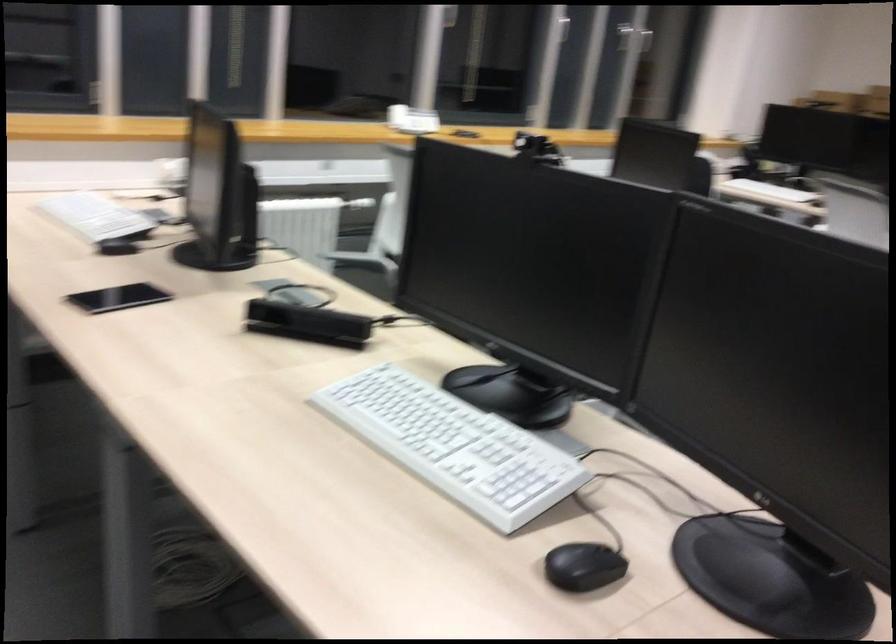
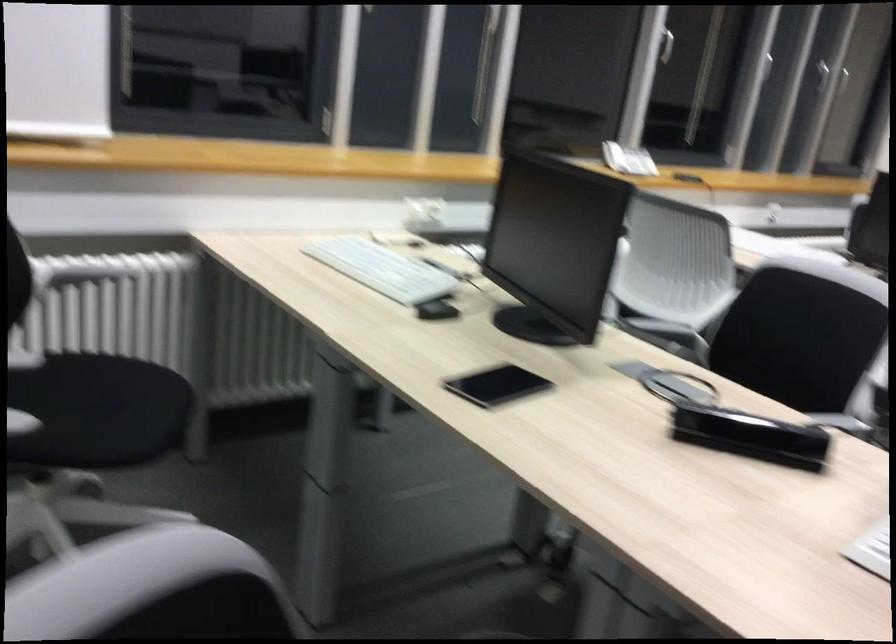
The point at (x=386, y=118) is marked in the first image. Where is the corresponding point in the second image?

(614, 156)